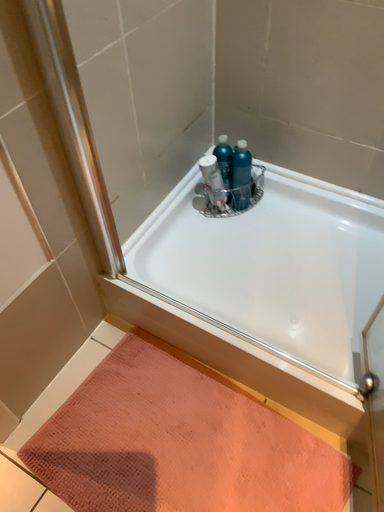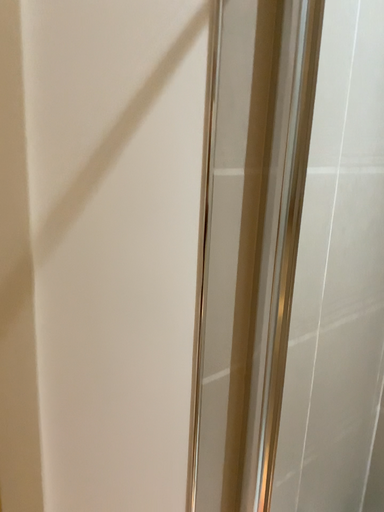
Question: Which way did the camera rotate in the video?

Choices:
 (A) rotated left
 (B) rotated right

Answer: (A)